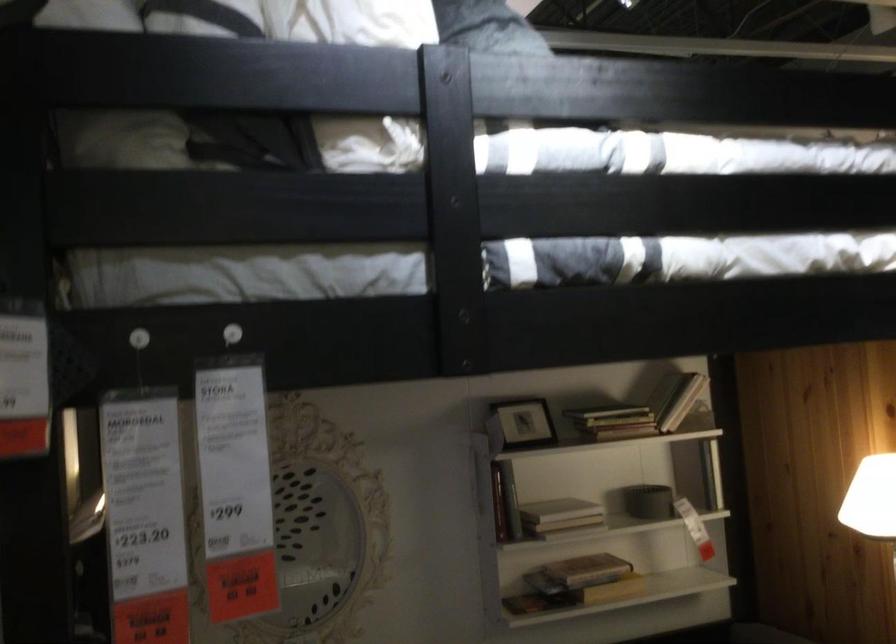
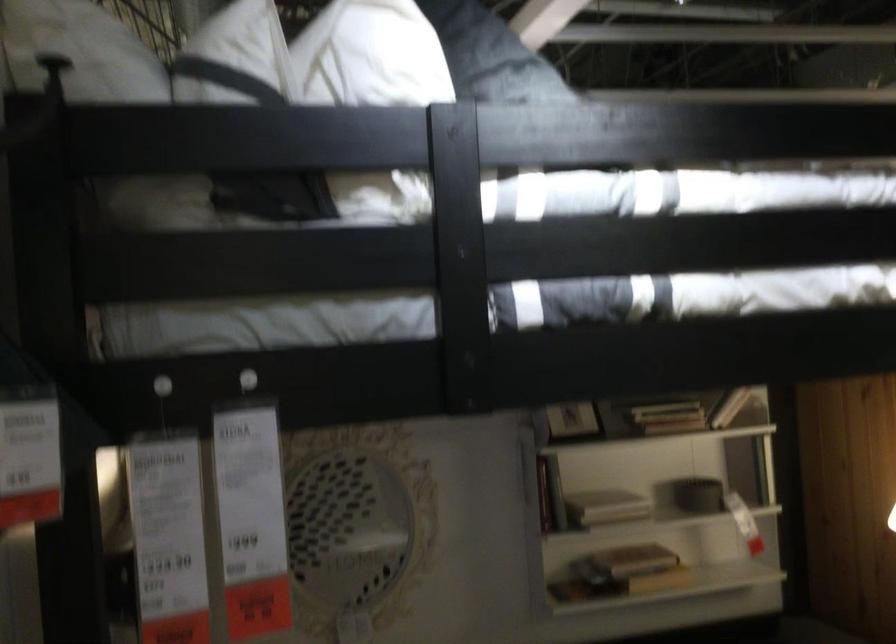
Question: Based on the continuous images, in which direction is the camera rotating? Reply with the corresponding letter.

Choices:
 (A) Left
 (B) Right
 (C) Up
 (D) Down

Answer: (A)